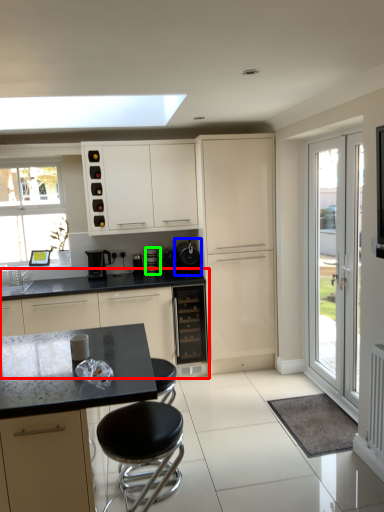
Question: Which object is the farthest from cabinetry (highlighted by a red box)? Choose among these: appliance (highlighted by a blue box) or coffee machine (highlighted by a green box).

Choices:
 (A) appliance
 (B) coffee machine

Answer: (A)